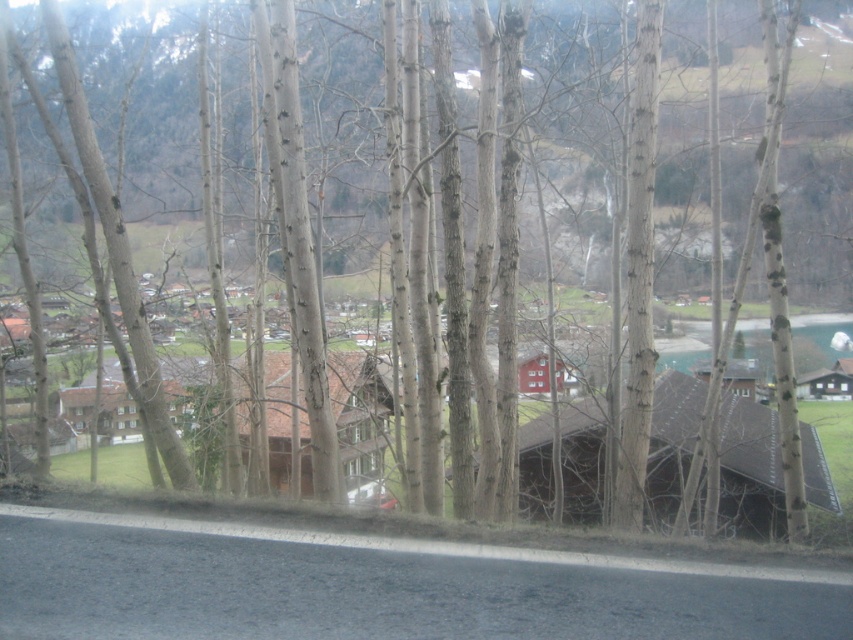
The width and height of the screenshot is (853, 640). What do you see at coordinates (358, 410) in the screenshot?
I see `brown wooden house at center` at bounding box center [358, 410].

Does brown wooden house at center have a larger size compared to wooden cabin at center-right?

Incorrect, brown wooden house at center is not larger than wooden cabin at center-right.

What do you see at coordinates (358, 410) in the screenshot? I see `brown wooden house at center` at bounding box center [358, 410].

Identify the location of brown wooden house at center. The width and height of the screenshot is (853, 640). (358, 410).

Consider the image. Between matte red house at center and transparent glass car window at lower center, which one has more height?

With more height is transparent glass car window at lower center.

The image size is (853, 640). I want to click on matte red house at center, so click(x=532, y=374).

Locate an element on the screen. This screenshot has height=640, width=853. matte red house at center is located at coordinates (532, 374).

Between wooden cabin at center-right and transparent glass car window at lower center, which one has less height?

wooden cabin at center-right is shorter.

Based on the photo, who is more forward, [821,380] or [364,497]?

Point [364,497] is in front.

Where is `wooden cabin at center-right`? This screenshot has width=853, height=640. wooden cabin at center-right is located at coordinates (827, 381).